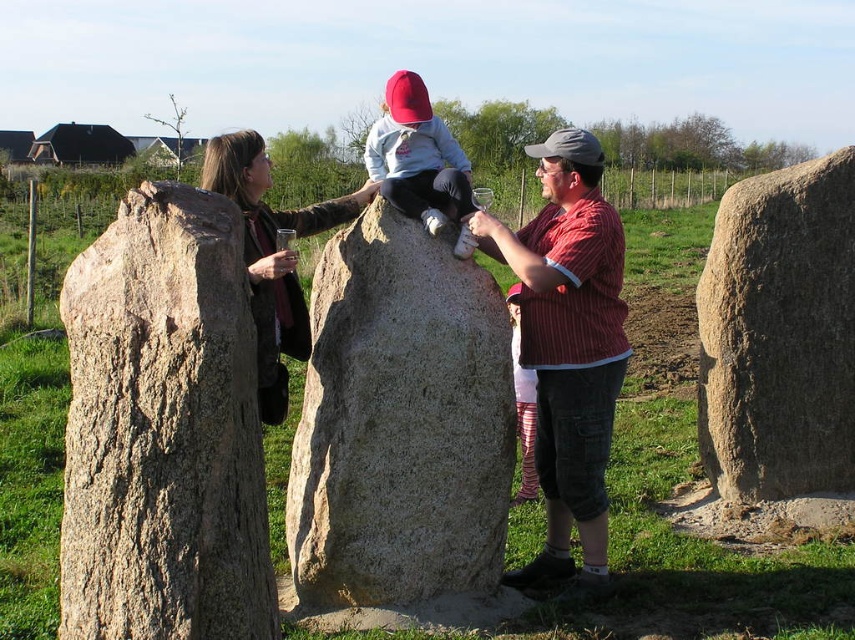
Question: Which object appears closest to the camera in this image?

Choices:
 (A) brown leather jacket at left
 (B) matte gray hoodie at center
 (C) matte red shirt at center
 (D) granite boulder at center

Answer: (A)

Question: Estimate the real-world distances between objects in this image. Which object is farther from the granite boulder at center?

Choices:
 (A) matte gray hoodie at center
 (B) rough textured stone at left
 (C) matte red shirt at center
 (D) smooth gray rock at center

Answer: (D)

Question: Can you confirm if granite boulder at center is positioned above matte gray hoodie at center?

Choices:
 (A) no
 (B) yes

Answer: (A)

Question: Which object appears farthest from the camera in this image?

Choices:
 (A) brown leather jacket at left
 (B) rough textured stone at left
 (C) matte gray hoodie at center
 (D) smooth gray rock at center

Answer: (D)

Question: Does brown leather jacket at left have a lesser width compared to matte gray hoodie at center?

Choices:
 (A) yes
 (B) no

Answer: (B)

Question: Can you confirm if rough textured stone at left is thinner than brown leather jacket at left?

Choices:
 (A) no
 (B) yes

Answer: (B)